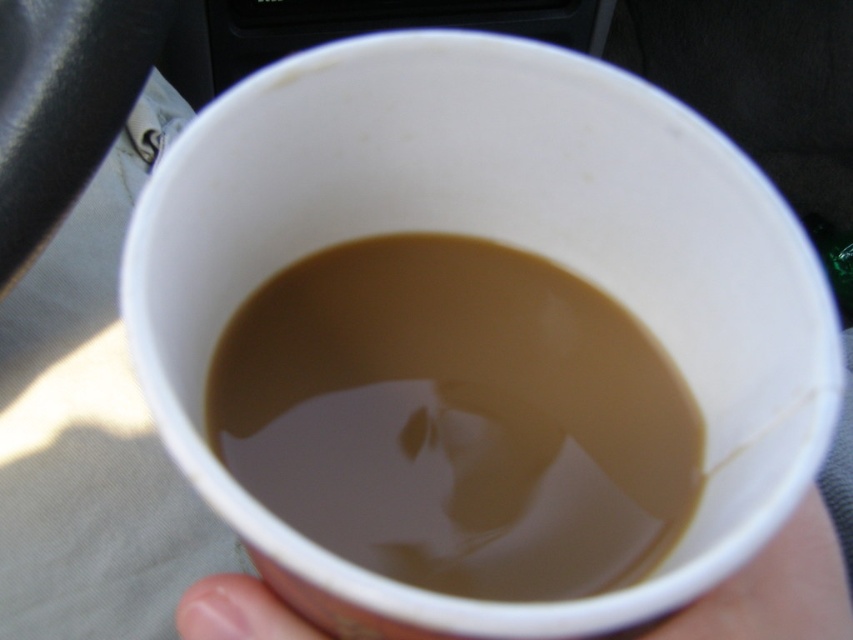
You are a barista trying to pour more liquid into the brown matte coffee at center inside the white paper cup at lower center. Can you fit more liquid into the cup without spilling?

The brown matte coffee at center has a lesser width compared to the white paper cup at lower center, meaning there is still space available. Therefore, you can pour more liquid into the cup without spilling.

You are a delivery driver who needs to place the brown matte coffee at center into the white paper cup at lower center. Can you do this without spilling the coffee?

The brown matte coffee at center is 2.24 inches away from the white paper cup at lower center. Since the distance is relatively small, you can carefully move the coffee to pour it into the cup without spilling.

You are a passenger in a car and want to place your drink somewhere safe. The brown matte coffee at center is in the white paper cup at lower center. Is the coffee inside the cup?

The brown matte coffee at center is above the white paper cup at lower center, which means the coffee is likely inside the cup since it is positioned directly above it.